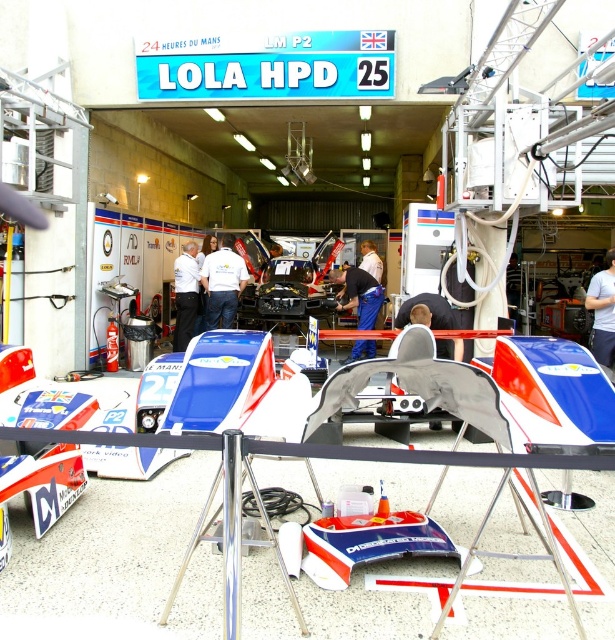
Question: Can you confirm if blue fabric pants at center is positioned to the left of white fabric shirt at center?

Choices:
 (A) no
 (B) yes

Answer: (A)

Question: Estimate the real-world distances between objects in this image. Which object is farther from the white fabric shirt at center?

Choices:
 (A) blue fabric pants at center
 (B) white shirt at center

Answer: (A)

Question: Is white shirt at center wider than white fabric shirt at center?

Choices:
 (A) yes
 (B) no

Answer: (A)

Question: Considering the real-world distances, which object is closest to the blue fabric pants at center?

Choices:
 (A) white fabric shirt at center
 (B) white shirt at center

Answer: (B)

Question: Which point is farther to the camera?

Choices:
 (A) white shirt at center
 (B) blue fabric pants at center
 (C) white fabric shirt at center

Answer: (C)

Question: Is blue fabric pants at center above white fabric shirt at center?

Choices:
 (A) yes
 (B) no

Answer: (B)